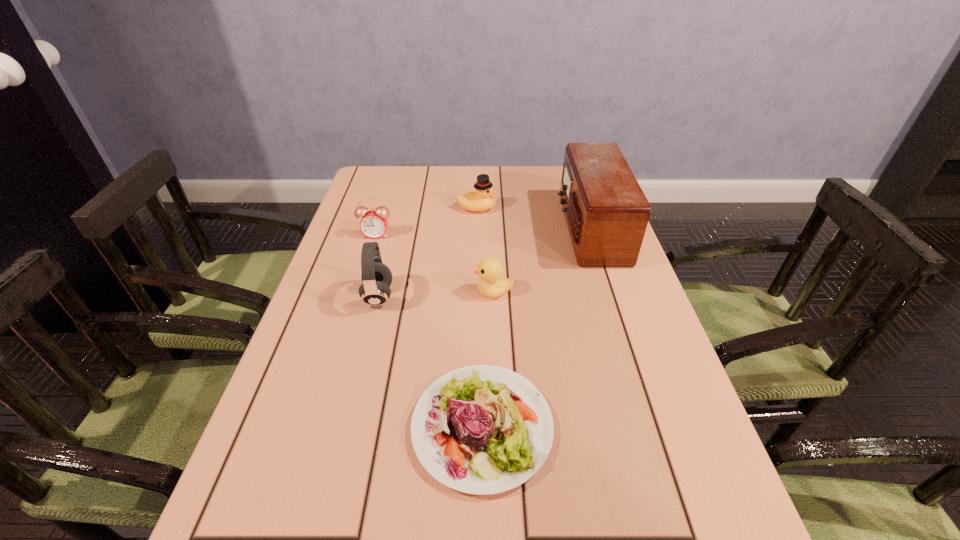
This screenshot has height=540, width=960. I want to click on headset located at the left edge, so click(376, 277).

Find the location of `alarm clock positioned at the left edge`. alarm clock positioned at the left edge is located at coordinates (373, 224).

In order to click on object that is at the right edge in this screenshot , I will do `click(606, 211)`.

Locate an element on the screen. This screenshot has width=960, height=540. object at the far right corner is located at coordinates (606, 211).

Image resolution: width=960 pixels, height=540 pixels. In the image, there is a desktop. Identify the location of free space at the far edge. (474, 171).

I want to click on vacant space at the left edge of the desktop, so click(x=336, y=266).

Find the location of a particular element. The height and width of the screenshot is (540, 960). free space at the right edge of the desktop is located at coordinates (637, 383).

This screenshot has height=540, width=960. What are the coordinates of `vacant space at the far left corner of the desktop` in the screenshot? It's located at (371, 197).

Image resolution: width=960 pixels, height=540 pixels. What are the coordinates of `unoccupied position between the alarm clock and the shortest object` in the screenshot? It's located at (429, 331).

Where is `unoccupied position between the alarm clock and the tallest object`? unoccupied position between the alarm clock and the tallest object is located at coordinates (483, 232).